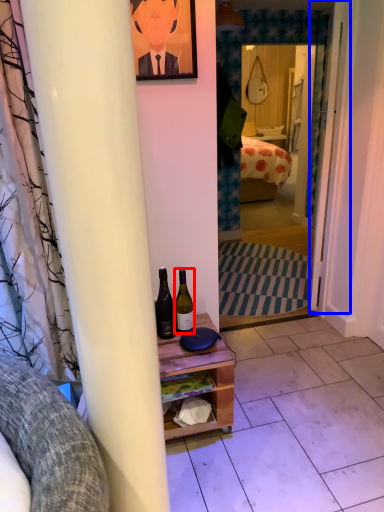
Question: Among these objects, which one is farthest to the camera, bottle (highlighted by a red box) or door (highlighted by a blue box)?

Choices:
 (A) bottle
 (B) door

Answer: (B)